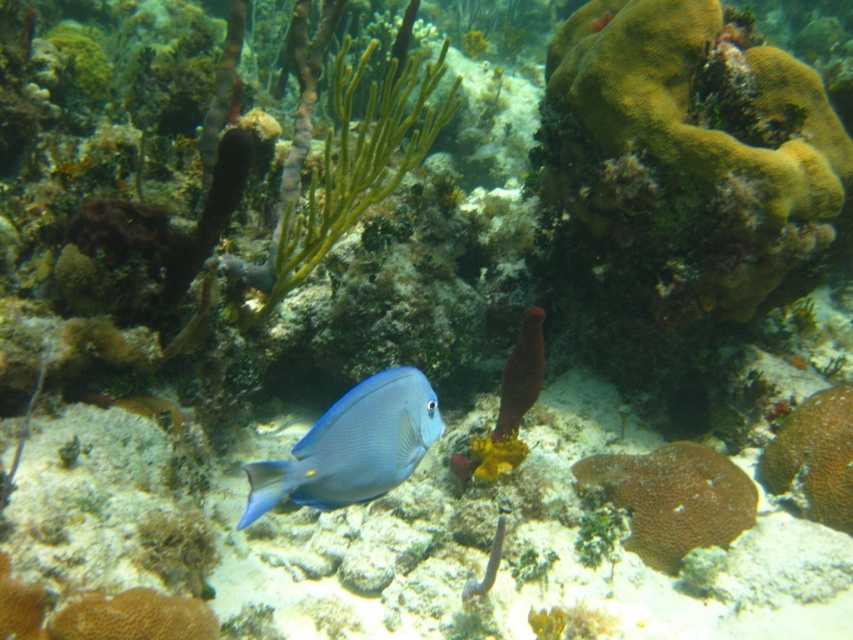
You are a marine biologist observing an underwater scene. You notice a point marked at coordinates (352, 445). What object is located at this point?

The point at coordinates (352, 445) marks the blue glossy fish at center.

You are a marine biologist observing the underwater scene. You notice the blue glossy fish at center and the brown textured coral at center. Which object has a greater height in the image?

The brown textured coral at center is taller than the blue glossy fish at center.

You are a marine biologist observing this underwater scene. You notice the blue glossy fish at center and the brown textured coral at center. Which object is closer to the observer?

The blue glossy fish at center is closer to the observer because it is in front of the brown textured coral at center.